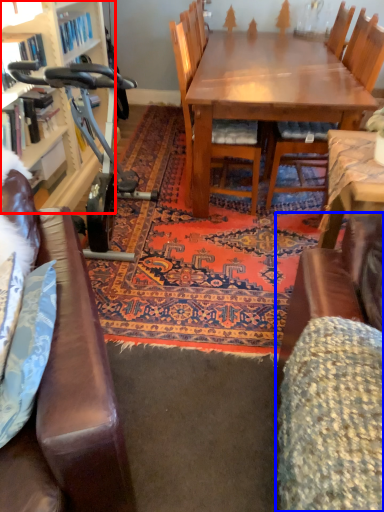
Question: Which object is further to the camera taking this photo, bookcase (highlighted by a red box) or swivel chair (highlighted by a blue box)?

Choices:
 (A) bookcase
 (B) swivel chair

Answer: (A)